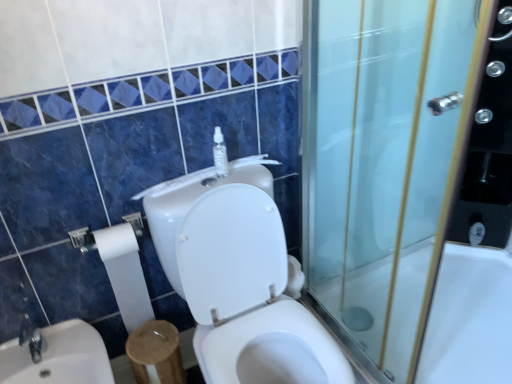
Question: Does white glossy sink at lower left have a greater height compared to white paper at left?

Choices:
 (A) no
 (B) yes

Answer: (B)

Question: Is white glossy sink at lower left at the right side of white paper at left?

Choices:
 (A) no
 (B) yes

Answer: (A)

Question: From the image's perspective, is white glossy sink at lower left on white paper at left?

Choices:
 (A) no
 (B) yes

Answer: (A)

Question: Is white paper at left inside white glossy sink at lower left?

Choices:
 (A) no
 (B) yes

Answer: (A)

Question: Is white glossy sink at lower left wider than white paper at left?

Choices:
 (A) yes
 (B) no

Answer: (A)

Question: Can you confirm if white glossy sink at lower left is shorter than white paper at left?

Choices:
 (A) yes
 (B) no

Answer: (B)

Question: From the image's perspective, would you say clear plastic bottle at upper center is shown under white glossy toilet at center?

Choices:
 (A) no
 (B) yes

Answer: (A)

Question: Could you tell me if clear plastic bottle at upper center is turned towards white glossy toilet at center?

Choices:
 (A) no
 (B) yes

Answer: (A)

Question: Does clear plastic bottle at upper center have a smaller size compared to white glossy toilet at center?

Choices:
 (A) yes
 (B) no

Answer: (A)

Question: Is clear plastic bottle at upper center facing away from white glossy toilet at center?

Choices:
 (A) yes
 (B) no

Answer: (B)

Question: Is clear plastic bottle at upper center closer to the viewer compared to white glossy toilet at center?

Choices:
 (A) yes
 (B) no

Answer: (B)

Question: Is clear plastic bottle at upper center outside of white glossy toilet at center?

Choices:
 (A) no
 (B) yes

Answer: (B)

Question: Considering the relative positions of clear plastic bottle at upper center and white glossy bathtub at right in the image provided, is clear plastic bottle at upper center to the left of white glossy bathtub at right from the viewer's perspective?

Choices:
 (A) yes
 (B) no

Answer: (A)